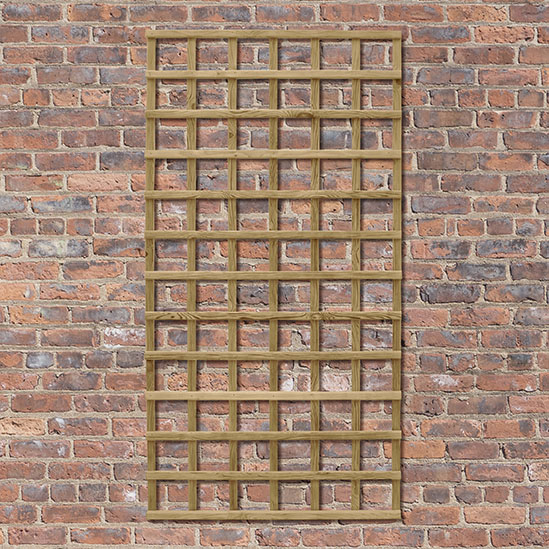
The height and width of the screenshot is (549, 549). I want to click on slats, so click(x=315, y=75).